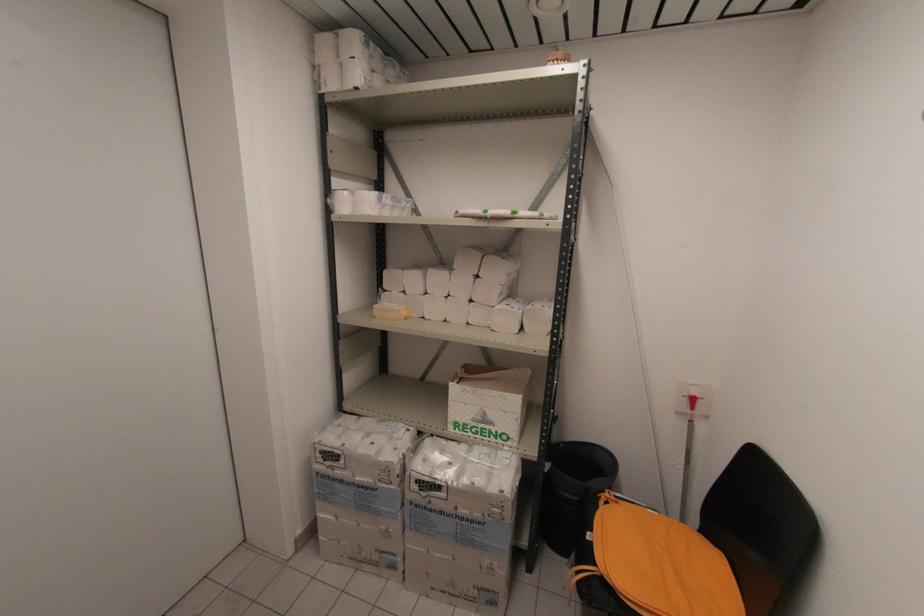
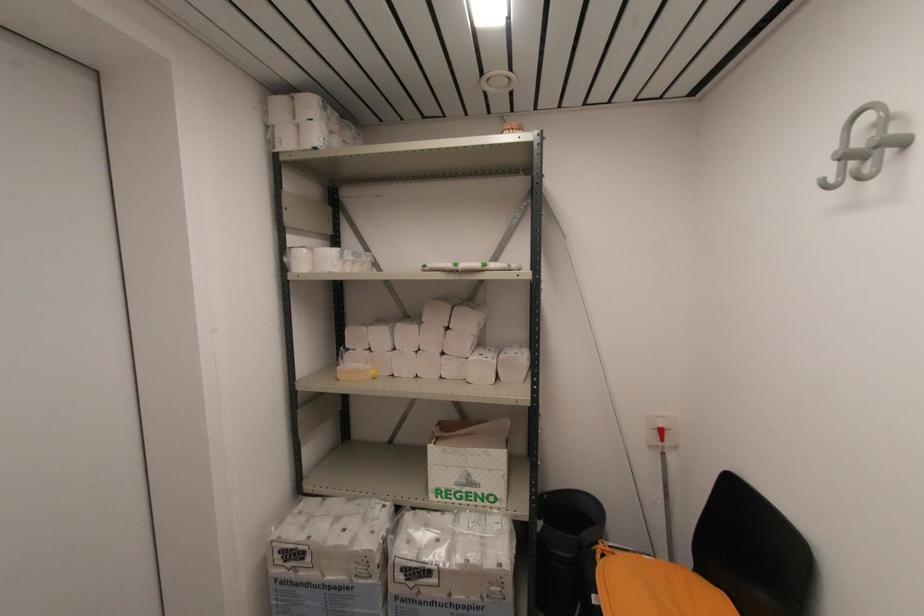
The point at (x=375, y=317) is marked in the first image. Where is the corresponding point in the second image?

(339, 381)